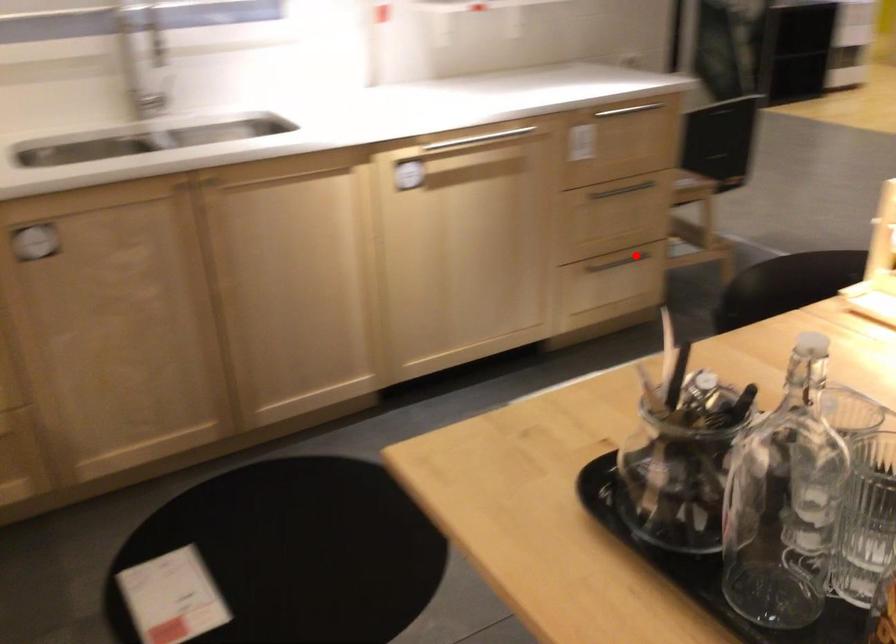
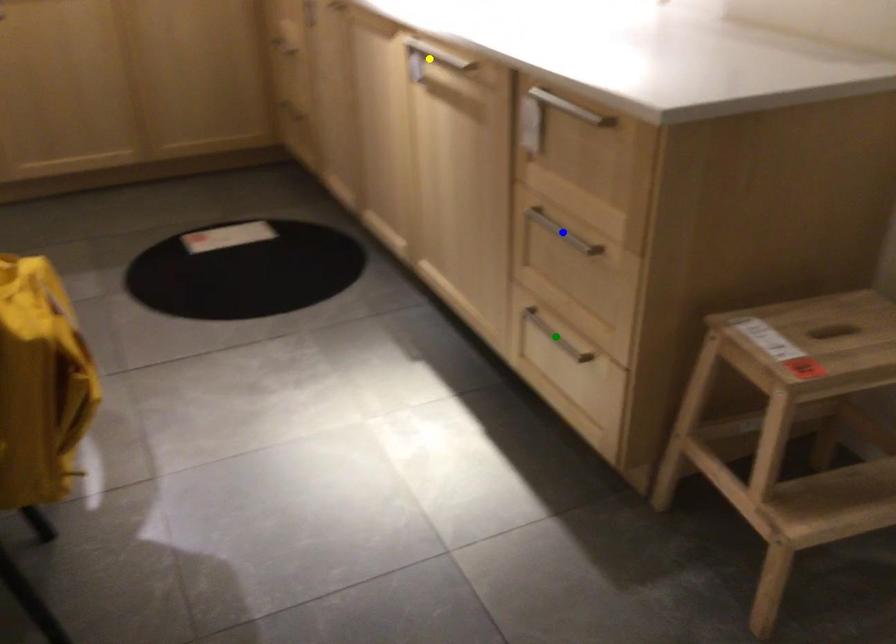
Question: I am providing you with two images of the same scene from different viewpoints. A red point is marked on the first image. You are given multiple points on the second image. Can you choose the point in image 2 that corresponds to the point in image 1?

Choices:
 (A) yellow point
 (B) green point
 (C) blue point

Answer: (B)